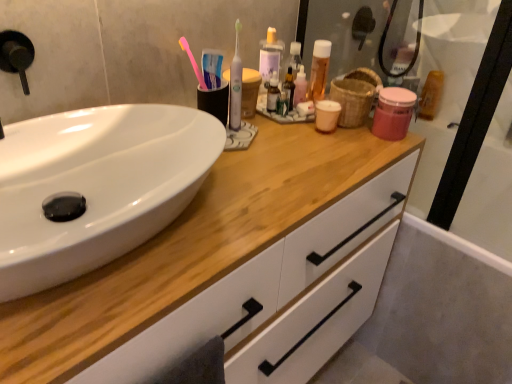
Image resolution: width=512 pixels, height=384 pixels. I want to click on empty space that is in between white glossy sink at left and pink matte jar at upper right, placed as the second mouthwash when sorted from left to right, so click(305, 158).